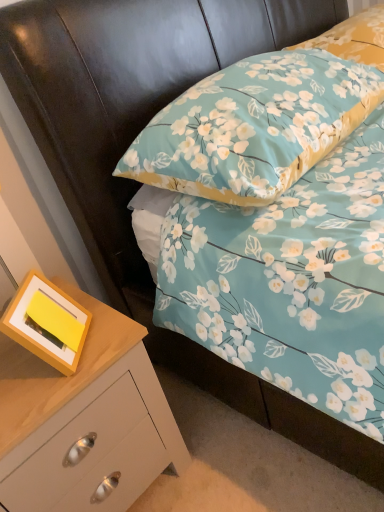
Question: From the image's perspective, is floral fabric pillow at upper right, the first pillow positioned from the top, beneath floral fabric pillow at upper center, marked as the second pillow in a top-to-bottom arrangement?

Choices:
 (A) no
 (B) yes

Answer: (A)

Question: Are floral fabric pillow at upper right, the second pillow positioned from the bottom, and floral fabric pillow at upper center, acting as the first pillow starting from the bottom, making contact?

Choices:
 (A) no
 (B) yes

Answer: (A)

Question: Can you confirm if floral fabric pillow at upper right, the second pillow positioned from the bottom, is positioned to the right of floral fabric pillow at upper center, marked as the second pillow in a top-to-bottom arrangement?

Choices:
 (A) yes
 (B) no

Answer: (A)

Question: Is floral fabric pillow at upper right, the second pillow positioned from the bottom, facing towards floral fabric pillow at upper center, marked as the second pillow in a top-to-bottom arrangement?

Choices:
 (A) no
 (B) yes

Answer: (A)

Question: Is floral fabric pillow at upper right, the first pillow positioned from the top, not close to floral fabric pillow at upper center, marked as the second pillow in a top-to-bottom arrangement?

Choices:
 (A) yes
 (B) no

Answer: (B)

Question: Considering the positions of floral fabric pillow at upper right, the second pillow positioned from the bottom, and yellow matte picture frame at lower left in the image, is floral fabric pillow at upper right, the second pillow positioned from the bottom, bigger or smaller than yellow matte picture frame at lower left?

Choices:
 (A) small
 (B) big

Answer: (B)

Question: Is floral fabric pillow at upper right, the second pillow positioned from the bottom, spatially inside yellow matte picture frame at lower left, or outside of it?

Choices:
 (A) inside
 (B) outside

Answer: (B)

Question: Is floral fabric pillow at upper right, the second pillow positioned from the bottom, in front of or behind yellow matte picture frame at lower left in the image?

Choices:
 (A) behind
 (B) front

Answer: (A)

Question: From a real-world perspective, is floral fabric pillow at upper right, the first pillow positioned from the top, physically located above or below yellow matte picture frame at lower left?

Choices:
 (A) below
 (B) above

Answer: (B)

Question: Looking at their shapes, would you say floral fabric pillow at upper center, marked as the second pillow in a top-to-bottom arrangement, is wider or thinner than yellow matte picture frame at lower left?

Choices:
 (A) wide
 (B) thin

Answer: (A)

Question: Looking at the image, does floral fabric pillow at upper center, marked as the second pillow in a top-to-bottom arrangement, seem bigger or smaller compared to yellow matte picture frame at lower left?

Choices:
 (A) big
 (B) small

Answer: (A)

Question: From the image's perspective, is floral fabric pillow at upper center, acting as the first pillow starting from the bottom, positioned above or below yellow matte picture frame at lower left?

Choices:
 (A) below
 (B) above

Answer: (B)

Question: From a real-world perspective, is floral fabric pillow at upper center, marked as the second pillow in a top-to-bottom arrangement, positioned above or below yellow matte picture frame at lower left?

Choices:
 (A) below
 (B) above

Answer: (B)

Question: From the image's perspective, relative to wooden chest of drawers at lower left, is floral fabric pillow at upper center, marked as the second pillow in a top-to-bottom arrangement, above or below?

Choices:
 (A) below
 (B) above

Answer: (B)

Question: Is point (248, 201) positioned closer to the camera than point (44, 377)?

Choices:
 (A) farther
 (B) closer

Answer: (A)